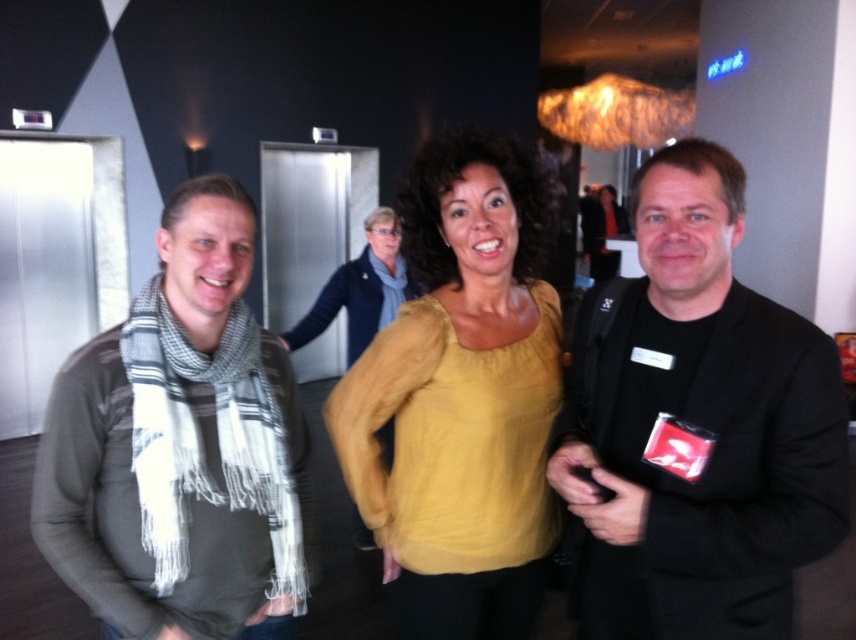
Question: In this image, where is black matte jacket at right located relative to plaid scarf at left?

Choices:
 (A) right
 (B) left

Answer: (A)

Question: Is plaid scarf at left wider than matte scarf at center?

Choices:
 (A) no
 (B) yes

Answer: (A)

Question: Which object is the farthest from the black matte jacket at right?

Choices:
 (A) matte scarf at center
 (B) yellow soft sweater at center

Answer: (A)

Question: Which is nearer to the black matte jacket at right?

Choices:
 (A) plaid scarf at left
 (B) matte scarf at center

Answer: (A)

Question: Does yellow soft sweater at center appear over matte scarf at center?

Choices:
 (A) no
 (B) yes

Answer: (A)

Question: Which of the following is the closest to the observer?

Choices:
 (A) black matte jacket at right
 (B) yellow soft sweater at center

Answer: (A)